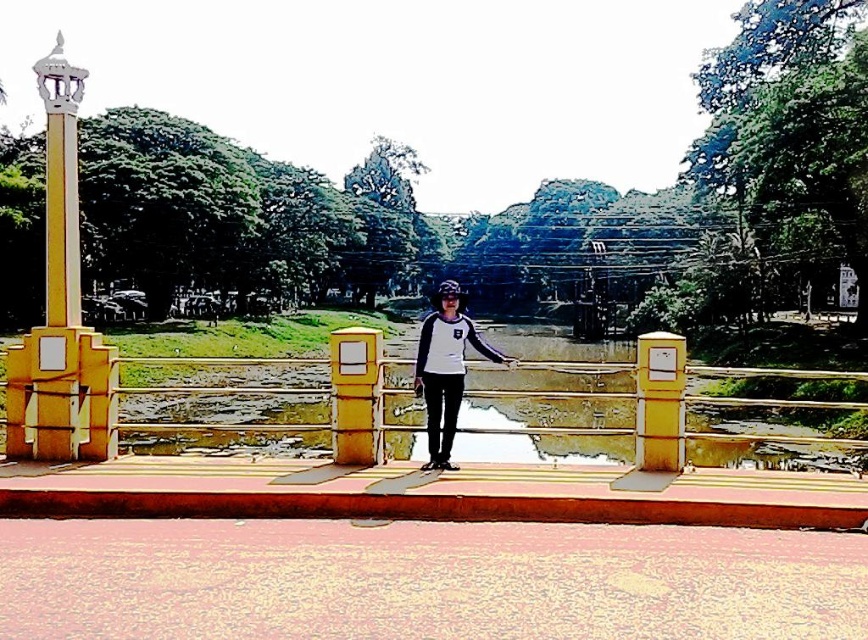
Question: Which is nearer to the yellow matte/light wood lamp post at left?

Choices:
 (A) yellow polished stone column at left
 (B) white matte shirt at center

Answer: (A)

Question: Which object appears closest to the camera in this image?

Choices:
 (A) yellow matte pillar at center
 (B) yellow polished stone column at left

Answer: (B)

Question: Which of the following is the farthest from the observer?

Choices:
 (A) (73, 116)
 (B) (442, 346)

Answer: (A)

Question: Does yellow polished stone column at left appear on the right side of yellow matte pillar at center?

Choices:
 (A) no
 (B) yes

Answer: (A)

Question: Can you confirm if white matte shirt at center is positioned to the left of yellow matte pillar at center?

Choices:
 (A) no
 (B) yes

Answer: (A)

Question: Does yellow matte/light wood lamp post at left appear on the left side of white matte shirt at center?

Choices:
 (A) yes
 (B) no

Answer: (A)